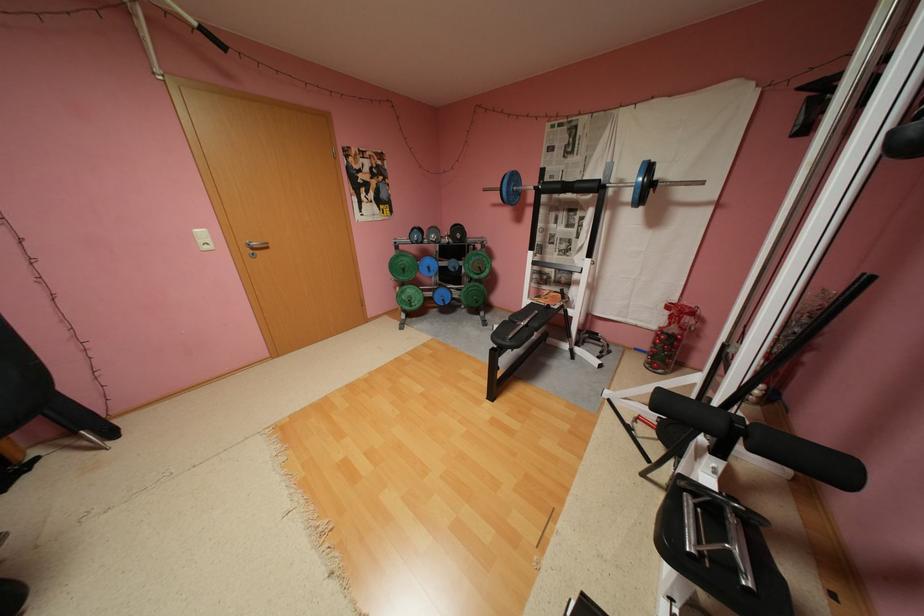
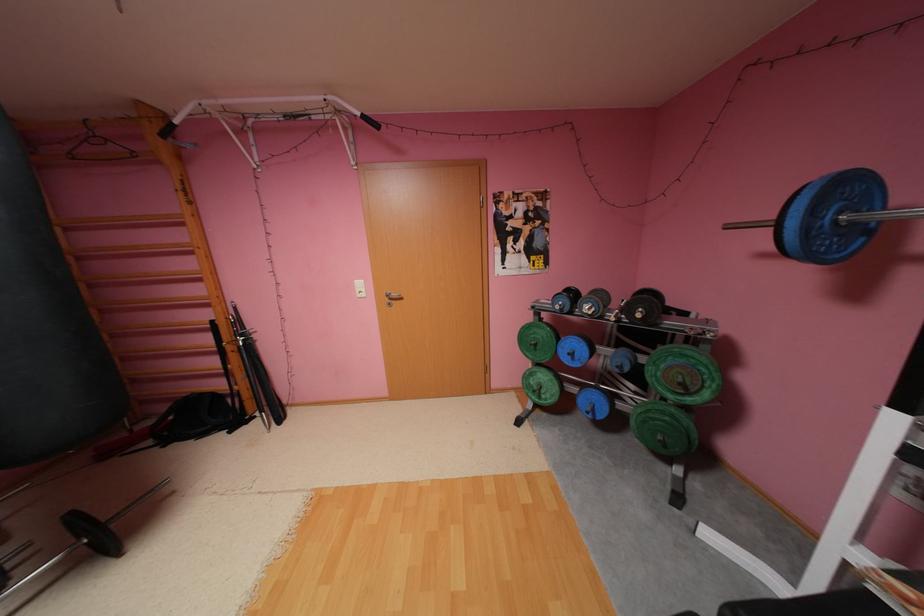
The point at (517, 191) is marked in the first image. Where is the corresponding point in the second image?

(816, 229)